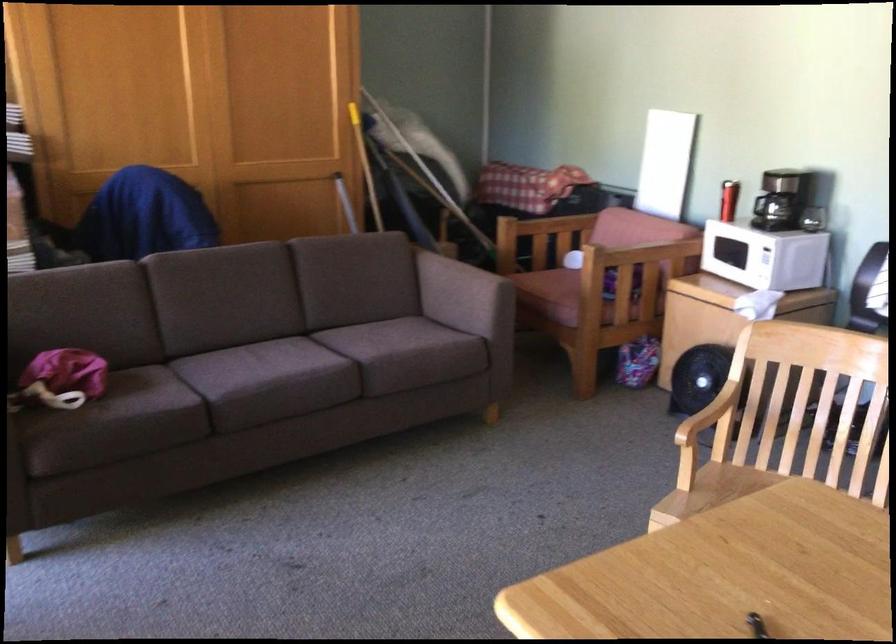
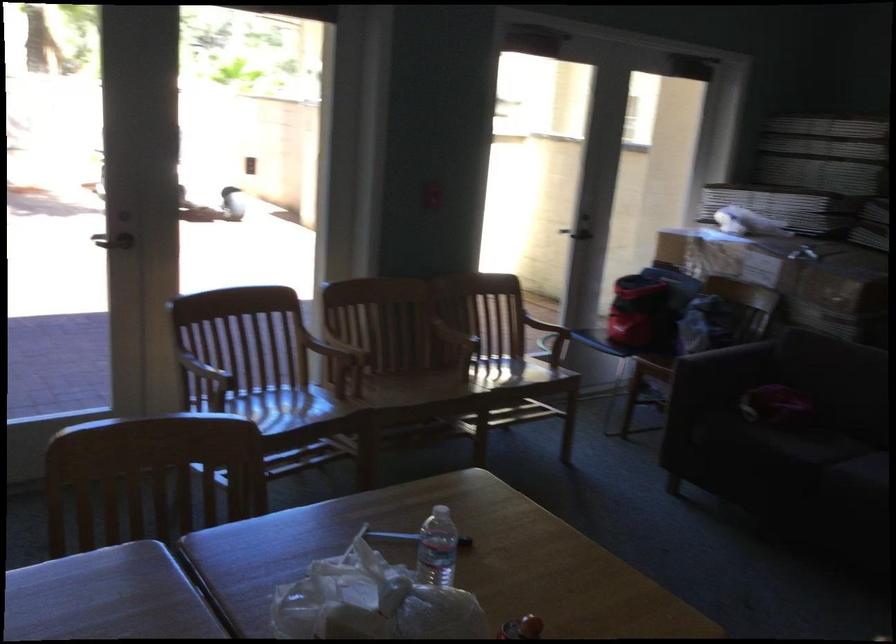
Find the pixel in the second image that matches (x=114, y=334) in the first image.

(843, 392)